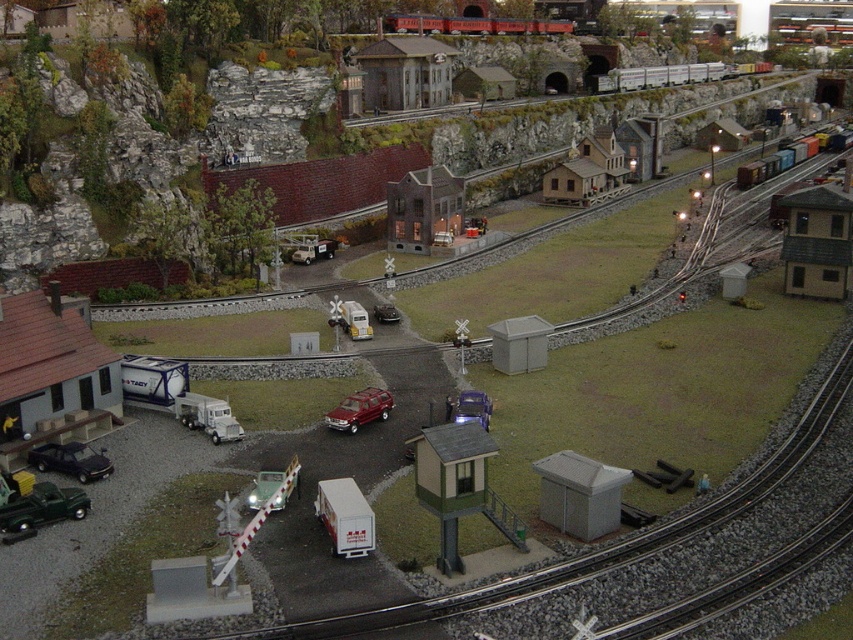
Question: Which point is farther to the camera?

Choices:
 (A) (773, 161)
 (B) (349, 417)
 (C) (393, 614)

Answer: (A)

Question: Which object appears closest to the camera in this image?

Choices:
 (A) metallic red train car at upper center
 (B) matte black car at lower left
 (C) green matte truck at lower left
 (D) metallic red suv at center

Answer: (C)

Question: Can you confirm if metal freight train at upper right is positioned below metallic silver truck at center?

Choices:
 (A) yes
 (B) no

Answer: (B)

Question: Considering the relative positions of metallic red train car at upper center and metal freight train at upper right in the image provided, where is metallic red train car at upper center located with respect to metal freight train at upper right?

Choices:
 (A) above
 (B) below

Answer: (A)

Question: Which of the following is the farthest from the observer?

Choices:
 (A) (96, 476)
 (B) (691, 532)

Answer: (A)

Question: Is metal freight train at upper right bigger than matte black car at lower left?

Choices:
 (A) yes
 (B) no

Answer: (A)